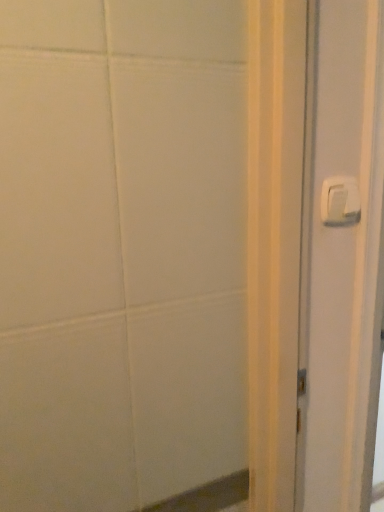
Identify the location of white plastic door handle at upper right. (340, 201).

In order to face white plastic door handle at upper right, should I rotate leftwards or rightwards?

You should rotate right by 19.728 degrees.

The width and height of the screenshot is (384, 512). Describe the element at coordinates (340, 201) in the screenshot. I see `white plastic door handle at upper right` at that location.

Image resolution: width=384 pixels, height=512 pixels. I want to click on white plastic door handle at upper right, so click(340, 201).